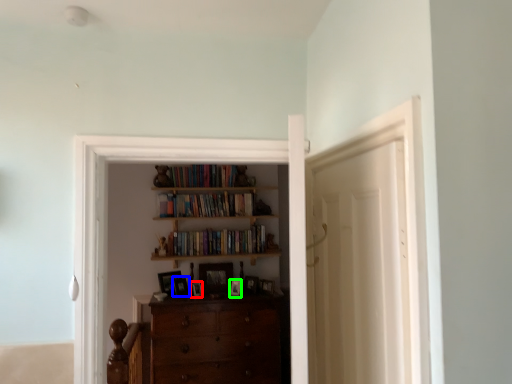
Question: Estimate the real-world distances between objects in this image. Which object is farther from picture frame (highlighted by a red box), picture frame (highlighted by a blue box) or picture frame (highlighted by a green box)?

Choices:
 (A) picture frame
 (B) picture frame

Answer: (B)